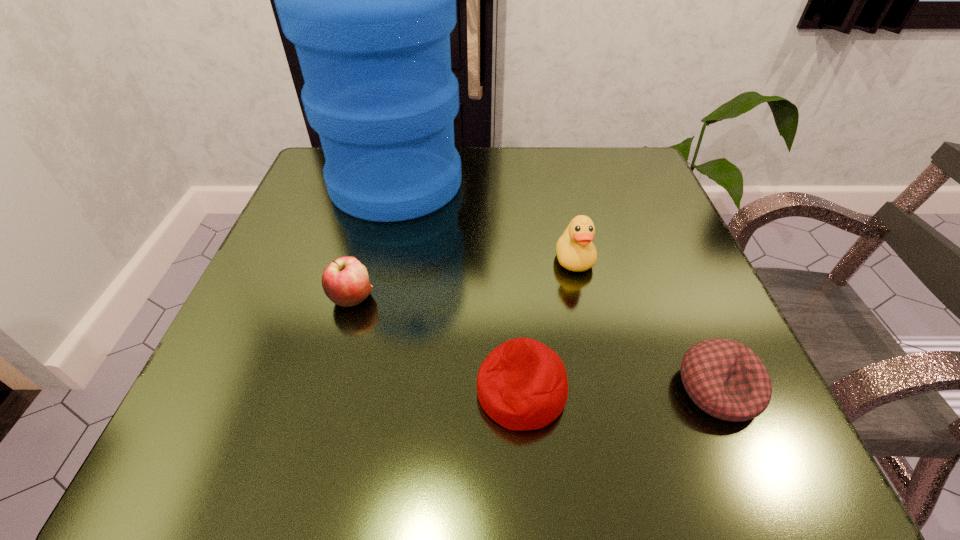
The height and width of the screenshot is (540, 960). I want to click on free space between the right beanbag and the second tallest object, so click(646, 324).

I want to click on vacant space that's between the apple and the water jug, so click(x=374, y=240).

This screenshot has width=960, height=540. In order to click on free space that is in between the third nearest object and the farthest object in this screenshot , I will do tap(374, 240).

Locate an element on the screen. Image resolution: width=960 pixels, height=540 pixels. vacant space that is in between the farthest object and the third farthest object is located at coordinates 374,240.

Find the location of a particular element. Image resolution: width=960 pixels, height=540 pixels. the second closest object to the third object from left to right is located at coordinates click(575, 251).

Identify the location of object that is the second closest to the right beanbag. This screenshot has width=960, height=540. (575, 251).

Where is `vacant region that satisfies the following two spatial constraints: 1. on the front side of the rightmost object; 2. on the seat area of the third object from right to left`? This screenshot has height=540, width=960. vacant region that satisfies the following two spatial constraints: 1. on the front side of the rightmost object; 2. on the seat area of the third object from right to left is located at coordinates (718, 391).

Identify the location of vacant region that satisfies the following two spatial constraints: 1. at the beak of the duck; 2. on the seat area of the left beanbag. The width and height of the screenshot is (960, 540). (604, 391).

Where is `vacant position in the image that satisfies the following two spatial constraints: 1. at the beak of the duck; 2. on the seat area of the third object from right to left`? The height and width of the screenshot is (540, 960). vacant position in the image that satisfies the following two spatial constraints: 1. at the beak of the duck; 2. on the seat area of the third object from right to left is located at coordinates (604, 391).

Where is `vacant space that satisfies the following two spatial constraints: 1. on the front side of the rightmost object; 2. on the seat area of the left beanbag`? This screenshot has height=540, width=960. vacant space that satisfies the following two spatial constraints: 1. on the front side of the rightmost object; 2. on the seat area of the left beanbag is located at coordinates (718, 391).